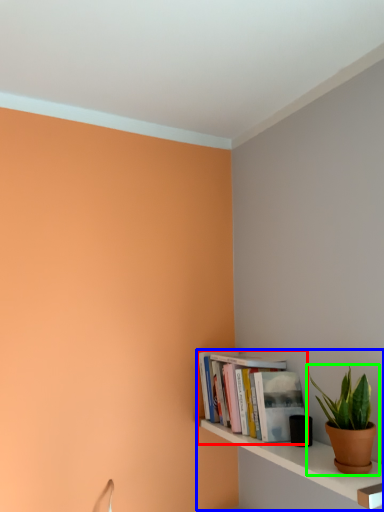
Question: Which object is the closest to the book (highlighted by a red box)? Choose among these: shelf (highlighted by a blue box) or houseplant (highlighted by a green box).

Choices:
 (A) shelf
 (B) houseplant

Answer: (A)